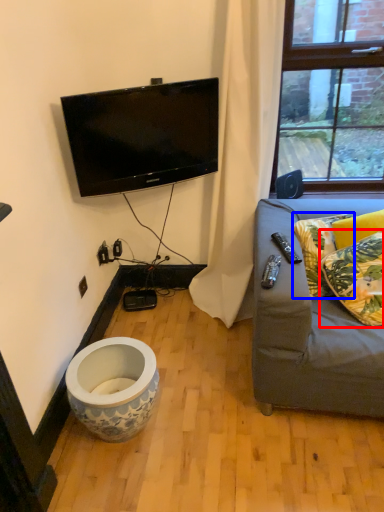
Question: Among these objects, which one is farthest to the camera, pillow (highlighted by a red box) or pillow (highlighted by a blue box)?

Choices:
 (A) pillow
 (B) pillow

Answer: (B)